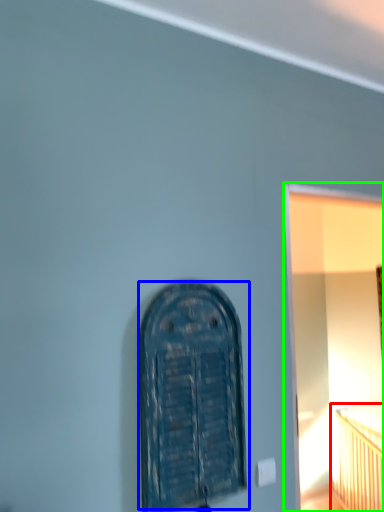
Question: Which object is positioned closest to bed (highlighted by a red box)? Select from door (highlighted by a blue box) and window frame (highlighted by a green box).

Choices:
 (A) door
 (B) window frame

Answer: (B)